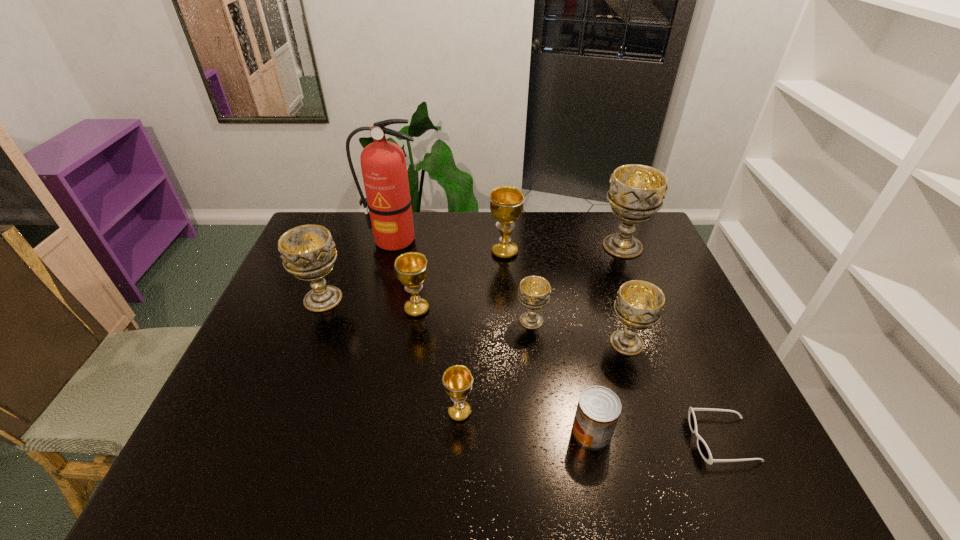
You are a GUI agent. You are given a task and a screenshot of the screen. Output one action in this format:
    pyautogui.click(x=<x>, y=<y>)
    Task: Click on the closest object to the leftmost white chalice
    
    Given the screenshot: What is the action you would take?
    pyautogui.click(x=383, y=164)

Find the location of a particular element. Image resolution: width=960 pixels, height=540 pixels. object that is the seventh nearest to the farthest gold chalice is located at coordinates (457, 380).

Select which chalice is the third closest to the biggest gold chalice. Please provide its 2D coordinates. Your answer should be formatted as a tuple, i.e. [(x, y)], where the tuple contains the x and y coordinates of a point satisfying the conditions above.

[(636, 192)]

Select which chalice is the second closest to the farthest gold chalice. Please provide its 2D coordinates. Your answer should be formatted as a tuple, i.e. [(x, y)], where the tuple contains the x and y coordinates of a point satisfying the conditions above.

[(411, 267)]

Image resolution: width=960 pixels, height=540 pixels. Find the location of `the closest white chalice to the third biggest white chalice`. the closest white chalice to the third biggest white chalice is located at coordinates (534, 292).

The width and height of the screenshot is (960, 540). In order to click on white chalice that is the closest to the sunglasses in this screenshot , I will do `click(639, 304)`.

Where is `gold chalice identified as the second closest to the red fire extinguisher`? Image resolution: width=960 pixels, height=540 pixels. gold chalice identified as the second closest to the red fire extinguisher is located at coordinates (411, 267).

Find the location of a particular element. This screenshot has width=960, height=540. the closest gold chalice to the fire extinguisher is located at coordinates (506, 202).

In order to click on vacant region that satisfies the following two spatial constraints: 1. on the back side of the leftmost white chalice; 2. on the right side of the biggest gold chalice in this screenshot , I will do `click(341, 252)`.

Locate an element on the screen. free space that satisfies the following two spatial constraints: 1. on the side of the red fire extinguisher with the nozzle and handle; 2. on the right side of the second gold chalice from right to left is located at coordinates (351, 412).